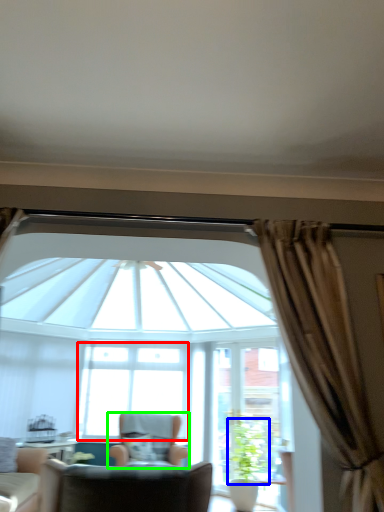
Question: Estimate the real-world distances between objects in this image. Which object is closer to window (highlighted by a red box), plant (highlighted by a blue box) or chair (highlighted by a green box)?

Choices:
 (A) plant
 (B) chair

Answer: (B)